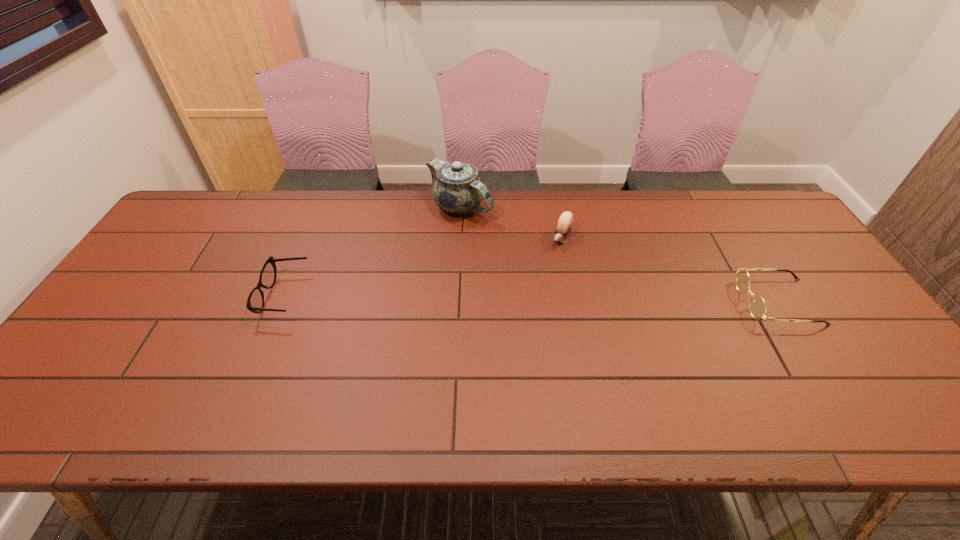
Where is `free space located 0.350m on the lenses of the rightmost object`? free space located 0.350m on the lenses of the rightmost object is located at coordinates 611,302.

Find the location of `free space located on the lenses of the rightmost object`. free space located on the lenses of the rightmost object is located at coordinates pos(712,302).

The height and width of the screenshot is (540, 960). I want to click on vacant space located 0.050m on the front-facing side of the escargot, so click(552, 260).

This screenshot has width=960, height=540. I want to click on blank space located 0.170m on the front-facing side of the escargot, so click(537, 287).

This screenshot has height=540, width=960. What are the coordinates of `vacant space located 0.370m on the front-facing side of the escargot` in the screenshot? It's located at (507, 340).

Identify the location of free space located 0.330m from the spout of the farthest object. This screenshot has height=540, width=960. (537, 289).

Locate an element on the screen. The image size is (960, 540). vacant space located from the spout of the farthest object is located at coordinates (488, 235).

Image resolution: width=960 pixels, height=540 pixels. Find the location of `free region located 0.130m from the spout of the farthest object`. free region located 0.130m from the spout of the farthest object is located at coordinates (498, 246).

Locate an element on the screen. This screenshot has height=540, width=960. escargot that is at the far edge is located at coordinates (565, 222).

This screenshot has width=960, height=540. What are the coordinates of `chinaware located in the far edge section of the desktop` in the screenshot? It's located at (457, 189).